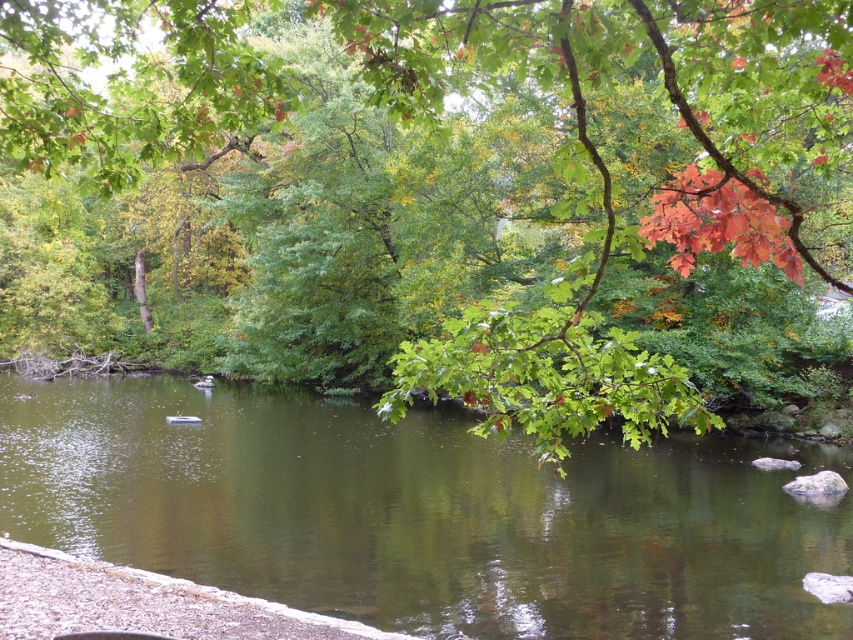
Which is more to the left, green leafy branch at upper center or green glossy water at center?

green leafy branch at upper center

Locate an element on the screen. green leafy branch at upper center is located at coordinates (437, 196).